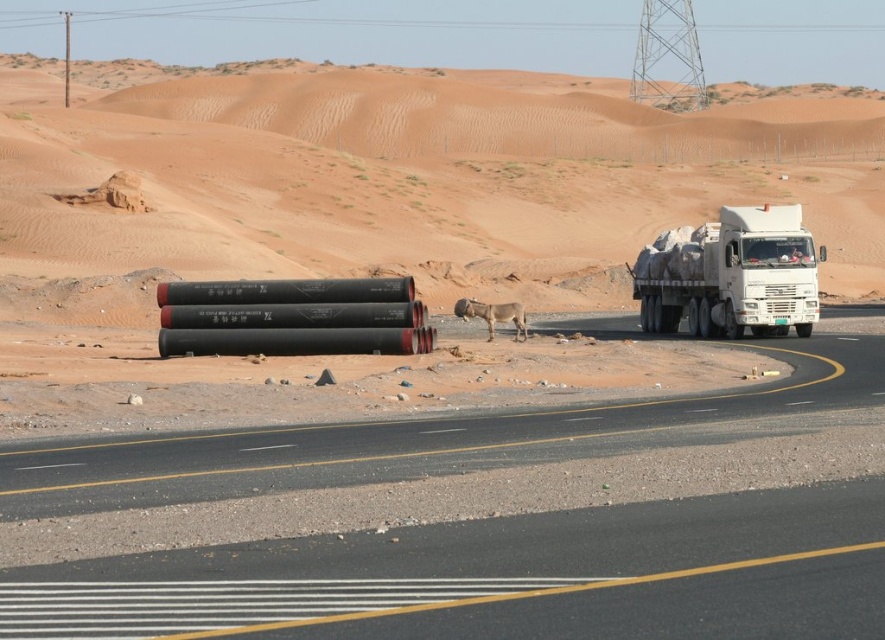
Does black asphalt highway at center appear over black matte pipes at center?

Actually, black asphalt highway at center is below black matte pipes at center.

Between black asphalt highway at center and black matte pipes at center, which one appears on the left side from the viewer's perspective?

Positioned to the left is black asphalt highway at center.

What are the coordinates of `black asphalt highway at center` in the screenshot? It's located at (475, 518).

Is white matte truck at right above brown furry dog at center?

Correct, white matte truck at right is located above brown furry dog at center.

Which is below, white matte truck at right or brown furry dog at center?

brown furry dog at center is below.

This screenshot has height=640, width=885. Find the location of `white matte truck at right`. white matte truck at right is located at coordinates (730, 275).

Which is below, brushed metal power line at upper center or white matte truck at right?

white matte truck at right is below.

Between brushed metal power line at upper center and white matte truck at right, which one has less height?

Standing shorter between the two is white matte truck at right.

This screenshot has height=640, width=885. I want to click on brushed metal power line at upper center, so click(x=343, y=12).